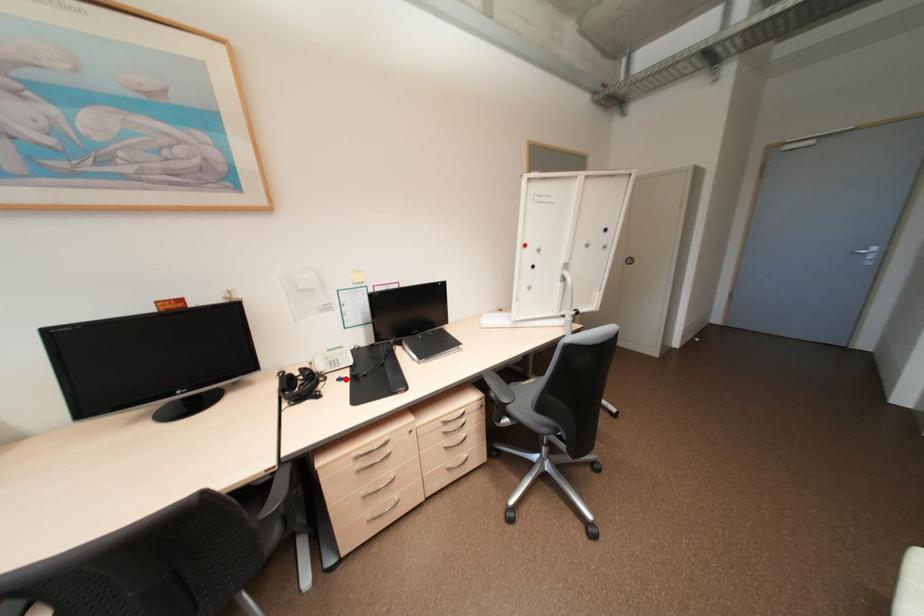
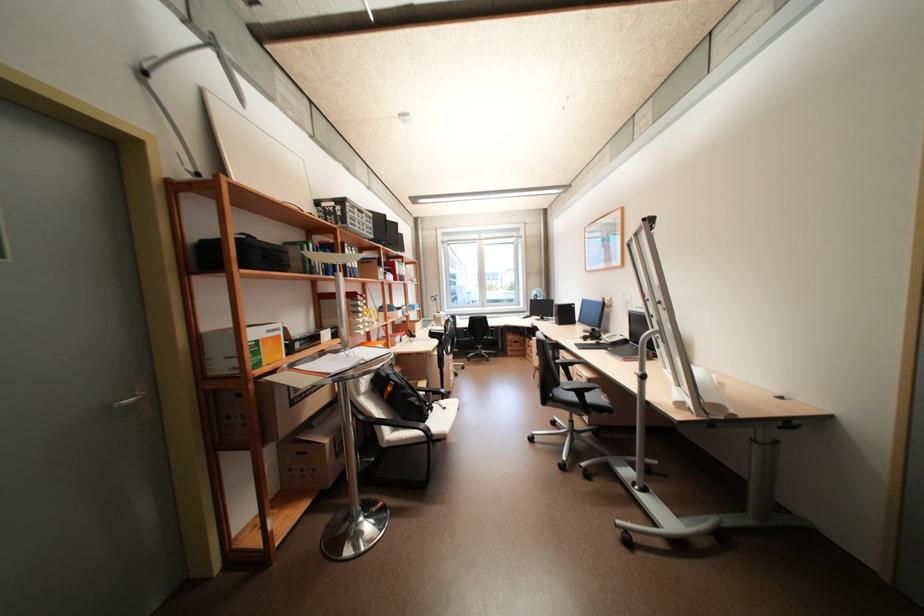
In the second image, find the point that corresponds to the highlighted location in the first image.

(603, 342)